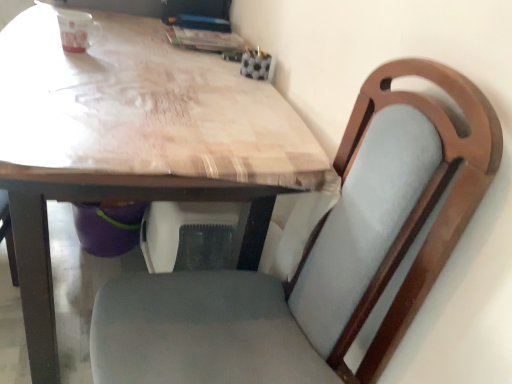
The height and width of the screenshot is (384, 512). I want to click on free point above wooden table at center (from a real-world perspective), so click(x=140, y=67).